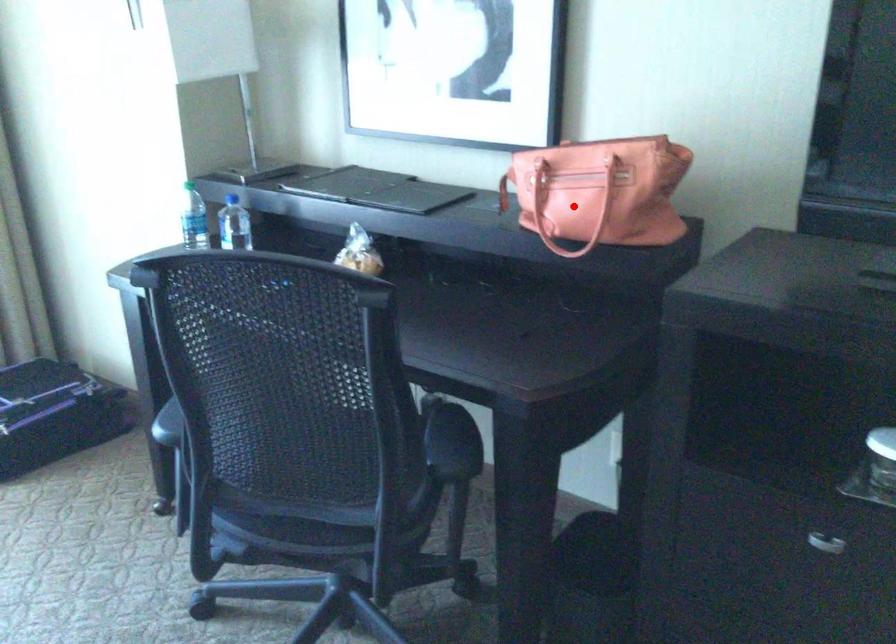
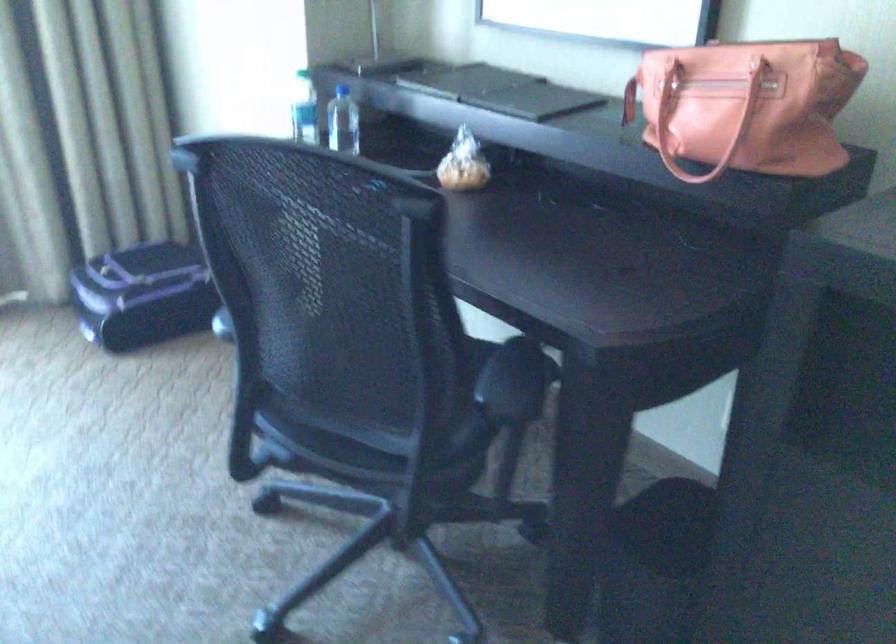
Question: I am providing you with two images of the same scene from different viewpoints. A red point is shown in image1. For the corresponding object point in image2, is it positioned nearer or farther from the camera?

Choices:
 (A) Nearer
 (B) Farther

Answer: (A)